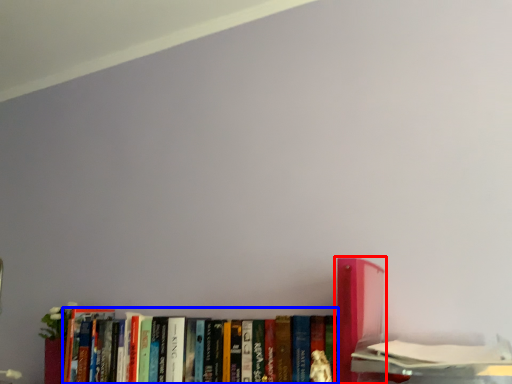
Question: Which object is further to the camera taking this photo, book (highlighted by a red box) or book (highlighted by a blue box)?

Choices:
 (A) book
 (B) book

Answer: (B)